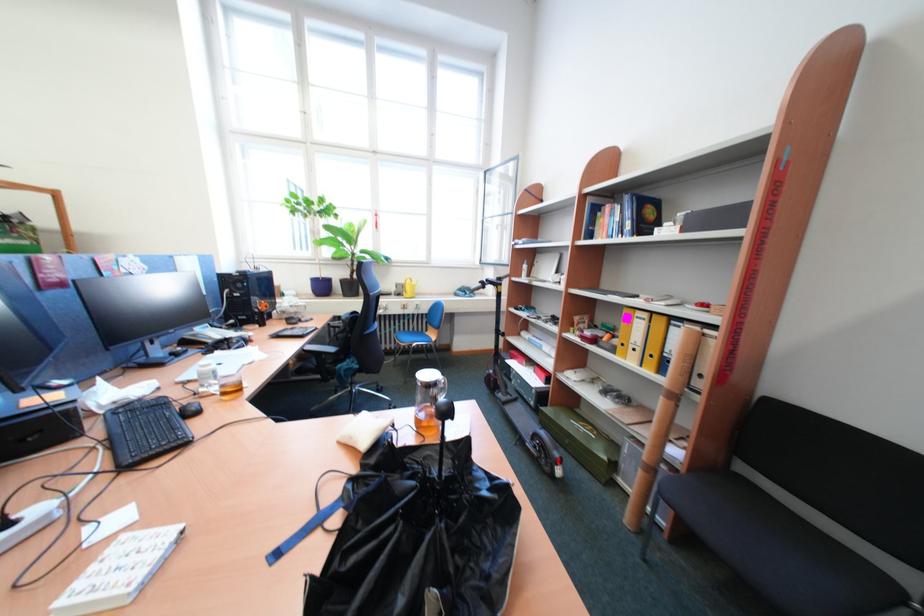
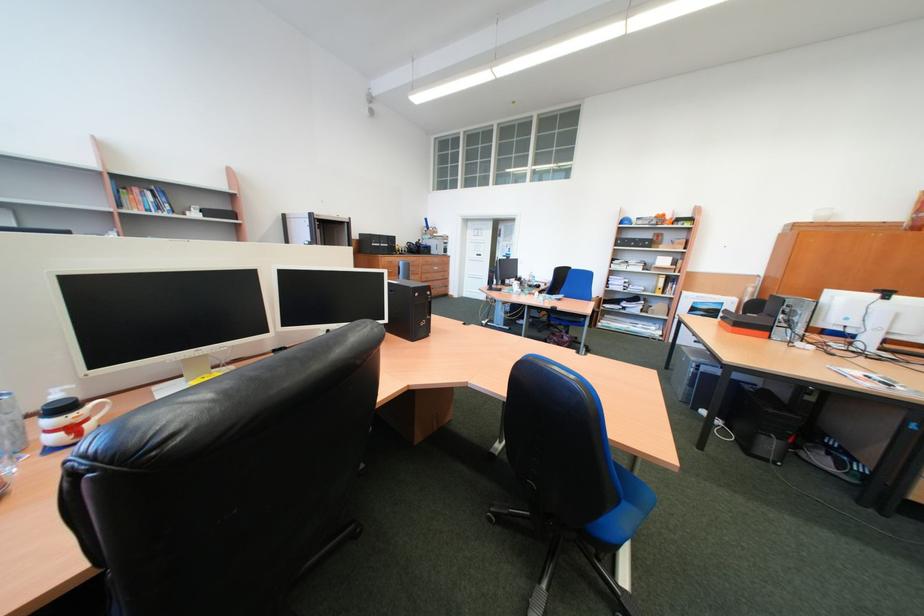
Question: I am providing you with two images of the same scene from different viewpoints. Which of the following objects are not visible in image2?

Choices:
 (A) scanner lid
 (B) office chair armrest
 (C) clear plastic bottle
 (D) blue safety helmet

Answer: (B)